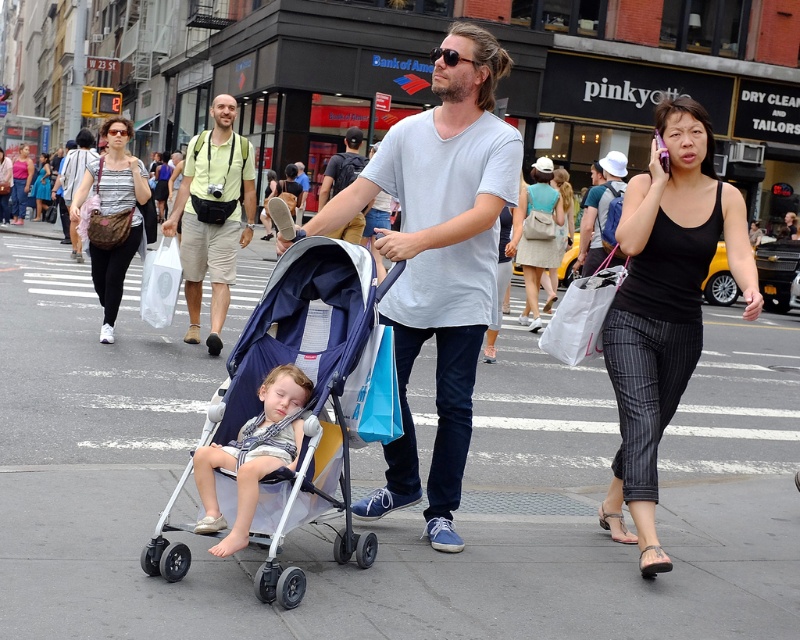
The height and width of the screenshot is (640, 800). Describe the element at coordinates (534, 269) in the screenshot. I see `turquoise fabric dress at center` at that location.

Is turquoise fabric dress at center to the right of light blue t-shirt at center from the viewer's perspective?

Yes, turquoise fabric dress at center is to the right of light blue t-shirt at center.

Does point (525, 232) come closer to viewer compared to point (344, 172)?

No, it is behind (344, 172).

The width and height of the screenshot is (800, 640). I want to click on turquoise fabric dress at center, so click(x=534, y=269).

Can you confirm if matte blue stroller at center is smaller than light blue t-shirt at center?

Incorrect, matte blue stroller at center is not smaller in size than light blue t-shirt at center.

Between point (270, 596) and point (318, 208), which one is positioned in front?

Point (270, 596) is in front.

Is point (314, 301) behind point (329, 163)?

No, (314, 301) is in front of (329, 163).

In order to click on matte blue stroller at center in this screenshot , I will do (x=308, y=401).

Looking at this image, how distant is gray asphalt at center from matte blue stroller at center?

They are 1.90 meters apart.

Which is behind, point (73, 524) or point (298, 593)?

Point (73, 524)

Where is `gray asphalt at center`? Image resolution: width=800 pixels, height=640 pixels. gray asphalt at center is located at coordinates (396, 512).